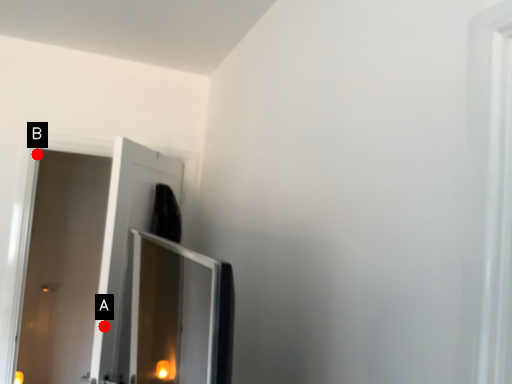
Question: Two points are circled on the image, labeled by A and B beside each circle. Which of the following is the closest to the observer?

Choices:
 (A) A is closer
 (B) B is closer

Answer: (A)